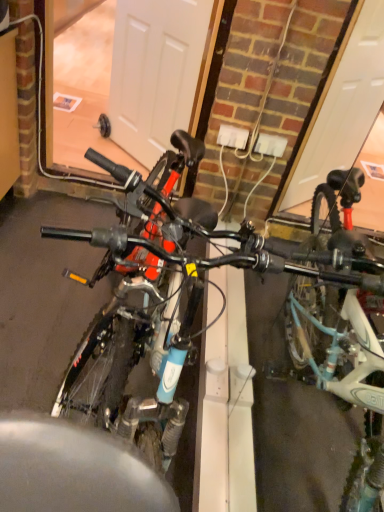
Question: Is white matte door at center closer to camera compared to blue matte bicycle at center, which is the 1th bicycle in left-to-right order?

Choices:
 (A) no
 (B) yes

Answer: (A)

Question: From a real-world perspective, is white matte door at center positioned under blue matte bicycle at center, the second bicycle viewed from the right, based on gravity?

Choices:
 (A) yes
 (B) no

Answer: (A)

Question: From the image's perspective, is white matte door at center under blue matte bicycle at center, the second bicycle viewed from the right?

Choices:
 (A) yes
 (B) no

Answer: (B)

Question: Is white matte door at center looking in the opposite direction of blue matte bicycle at center, the second bicycle viewed from the right?

Choices:
 (A) no
 (B) yes

Answer: (A)

Question: From a real-world perspective, is white matte door at center positioned over blue matte bicycle at center, the second bicycle viewed from the right, based on gravity?

Choices:
 (A) no
 (B) yes

Answer: (A)

Question: Is blue matte bicycle at center, which is the 1th bicycle in left-to-right order, located within white matte door at center?

Choices:
 (A) yes
 (B) no

Answer: (B)

Question: From a real-world perspective, does blue matte bicycle at center, which is the 1th bicycle in left-to-right order, sit lower than teal matte bicycle at right, which ranks as the 1th bicycle in right-to-left order?

Choices:
 (A) no
 (B) yes

Answer: (B)

Question: From the image's perspective, is blue matte bicycle at center, the second bicycle viewed from the right, below teal matte bicycle at right, placed as the second bicycle when sorted from left to right?

Choices:
 (A) no
 (B) yes

Answer: (B)

Question: Are blue matte bicycle at center, the second bicycle viewed from the right, and teal matte bicycle at right, placed as the second bicycle when sorted from left to right, far apart?

Choices:
 (A) no
 (B) yes

Answer: (A)

Question: Considering the relative sizes of blue matte bicycle at center, the second bicycle viewed from the right, and teal matte bicycle at right, placed as the second bicycle when sorted from left to right, in the image provided, is blue matte bicycle at center, the second bicycle viewed from the right, taller than teal matte bicycle at right, placed as the second bicycle when sorted from left to right,?

Choices:
 (A) no
 (B) yes

Answer: (A)

Question: Does blue matte bicycle at center, the second bicycle viewed from the right, appear on the right side of teal matte bicycle at right, which ranks as the 1th bicycle in right-to-left order?

Choices:
 (A) yes
 (B) no

Answer: (B)

Question: Is blue matte bicycle at center, the second bicycle viewed from the right, further to the viewer compared to teal matte bicycle at right, which ranks as the 1th bicycle in right-to-left order?

Choices:
 (A) no
 (B) yes

Answer: (B)

Question: Can you confirm if blue matte bicycle at center, which is the 1th bicycle in left-to-right order, is wider than white matte door at center?

Choices:
 (A) yes
 (B) no

Answer: (A)